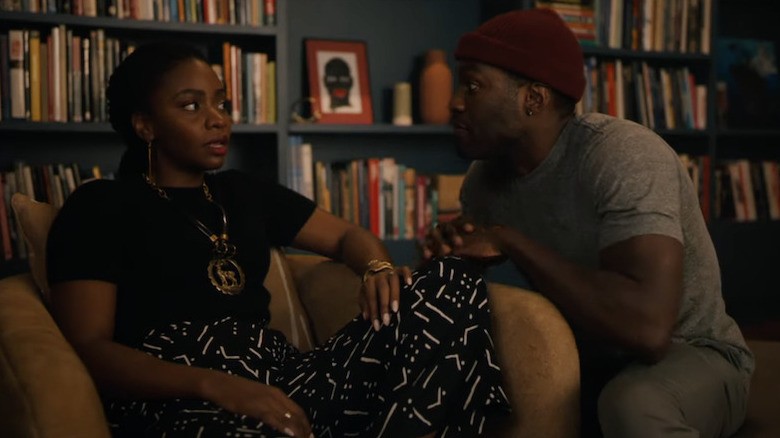
The height and width of the screenshot is (438, 780). Identify the location of corner. (741, 34).